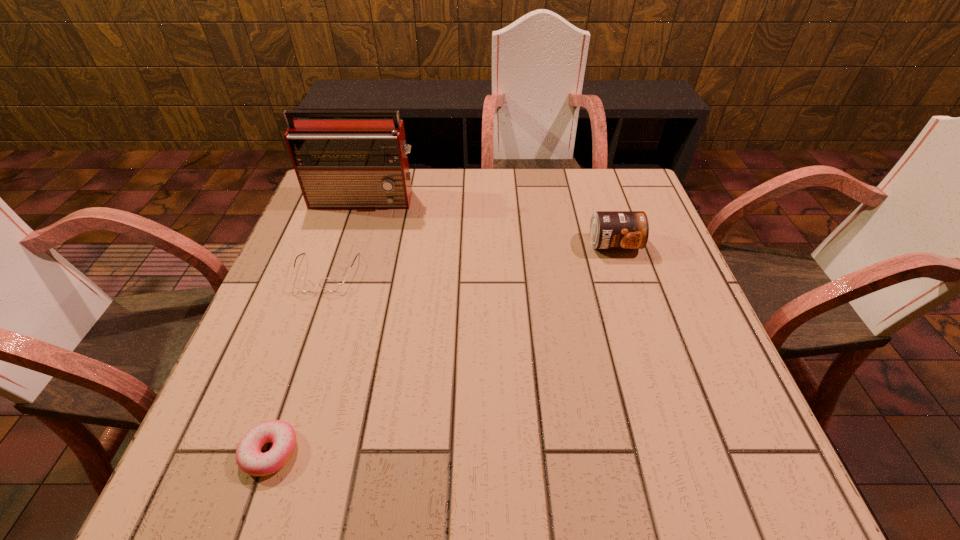
Where is `free spot between the can and the third tallest object`? free spot between the can and the third tallest object is located at coordinates (469, 258).

Image resolution: width=960 pixels, height=540 pixels. I want to click on free space between the radio receiver and the second shortest object, so (345, 236).

I want to click on free space between the third shortest object and the third tallest object, so click(469, 258).

Locate an element on the screen. This screenshot has width=960, height=540. vacant area between the doughnut and the spectacles is located at coordinates (298, 362).

Locate an element on the screen. The height and width of the screenshot is (540, 960). object that is the third closest to the doughnut is located at coordinates (608, 229).

Point out which object is positioned as the second nearest to the tallest object. Please provide its 2D coordinates. Your answer should be formatted as a tuple, i.e. [(x, y)], where the tuple contains the x and y coordinates of a point satisfying the conditions above.

[(608, 229)]